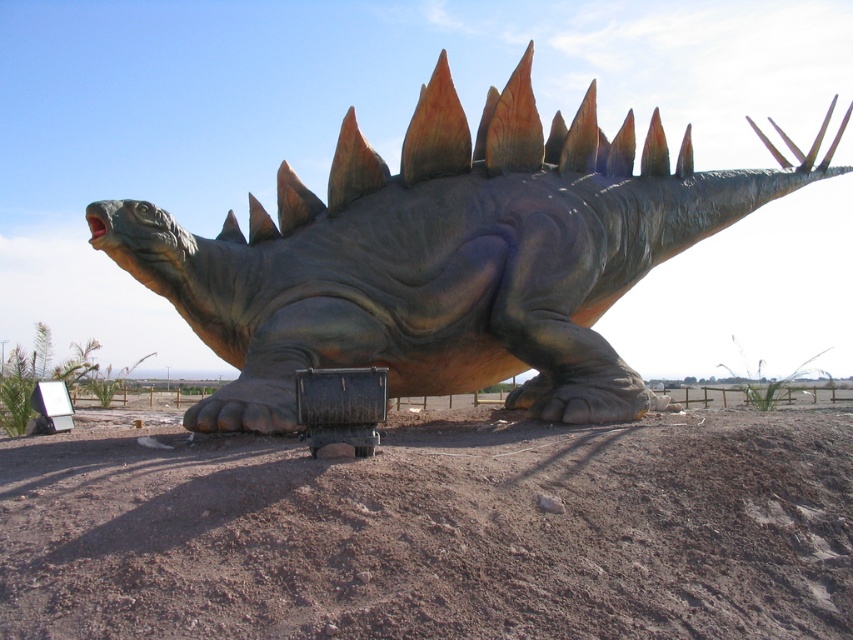
Question: Is brown sandy dirt at center thinner than shiny metallic dinosaur at center?

Choices:
 (A) yes
 (B) no

Answer: (B)

Question: Does brown sandy dirt at center appear on the right side of shiny metallic dinosaur at center?

Choices:
 (A) no
 (B) yes

Answer: (B)

Question: Does brown sandy dirt at center have a greater width compared to shiny metallic dinosaur at center?

Choices:
 (A) no
 (B) yes

Answer: (B)